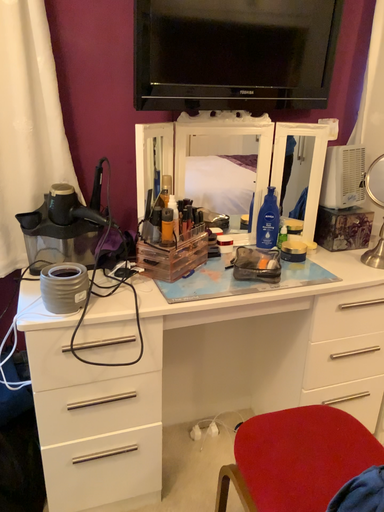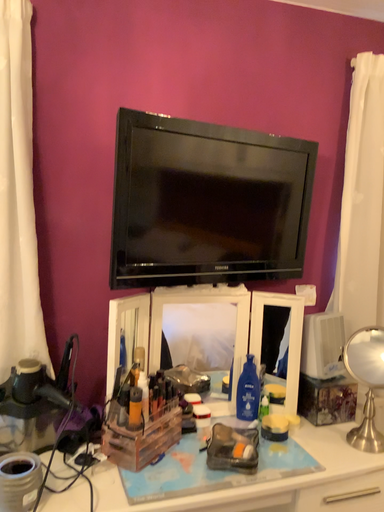
Question: How did the camera likely rotate when shooting the video?

Choices:
 (A) rotated downward
 (B) rotated upward

Answer: (B)